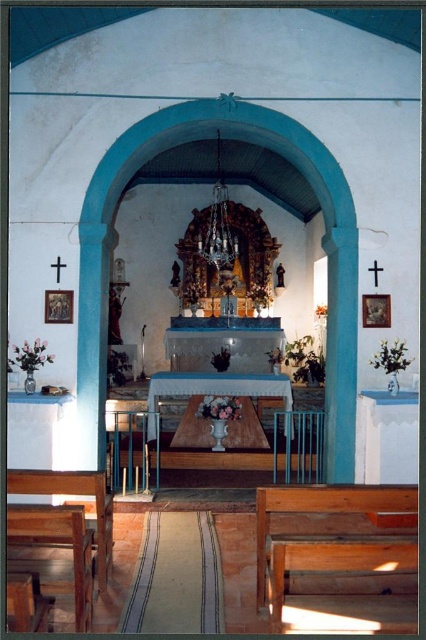
Question: Is wooden bench at lower right closer to the viewer compared to wooden bench at lower left?

Choices:
 (A) no
 (B) yes

Answer: (B)

Question: Which point appears farthest from the camera in this image?

Choices:
 (A) (89, 486)
 (B) (282, 500)

Answer: (A)

Question: Which point appears closest to the camera in this image?

Choices:
 (A) (100, 566)
 (B) (290, 568)

Answer: (B)

Question: Is wooden bench at lower right to the left of wooden bench at lower left from the viewer's perspective?

Choices:
 (A) yes
 (B) no

Answer: (B)

Question: Which of the following is the closest to the observer?

Choices:
 (A) (94, 477)
 (B) (342, 490)

Answer: (B)

Question: Is wooden bench at lower right bigger than wooden bench at lower left?

Choices:
 (A) no
 (B) yes

Answer: (B)